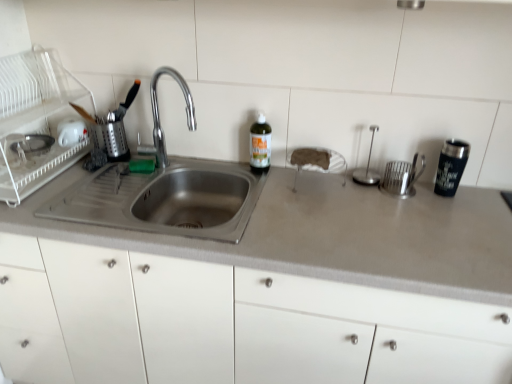
The width and height of the screenshot is (512, 384). Find the location of `vacant space positioned to the left of polished stainless steel spoon holder at right, which is counted as the 4th appliance, starting from the left`. vacant space positioned to the left of polished stainless steel spoon holder at right, which is counted as the 4th appliance, starting from the left is located at coordinates (332, 187).